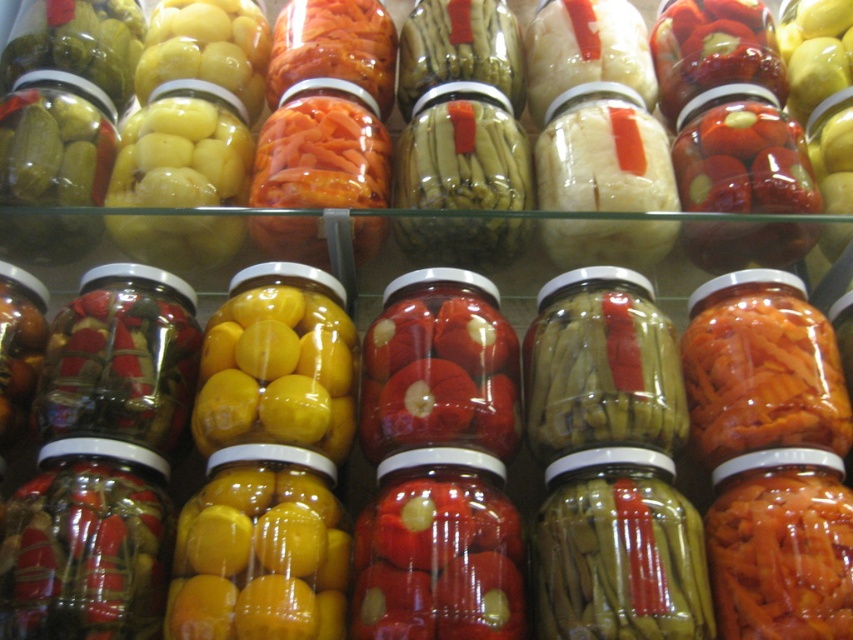
You are a customer at a store and want to buy a jar of pickles. You notice the green matte pickles at center and the translucent glass jar at left. Which item is shorter in height?

The green matte pickles at center has a lesser height compared to the translucent glass jar at left, so the green matte pickles at center is shorter in height.

You are looking at the jars of pickled vegetables. There are two points marked in the image, one at coordinates point (648, 548) and another at point (120, 410). Which of these points is closer to you?

Point (648, 548) is closer to the camera than point (120, 410).

You are organizing a display of jars and need to ensure that the green matte pickles at center and the translucent glass jar at left fit on a shelf. Which object requires more space due to its larger size?

The translucent glass jar at left requires more space because it is larger than the green matte pickles at center.